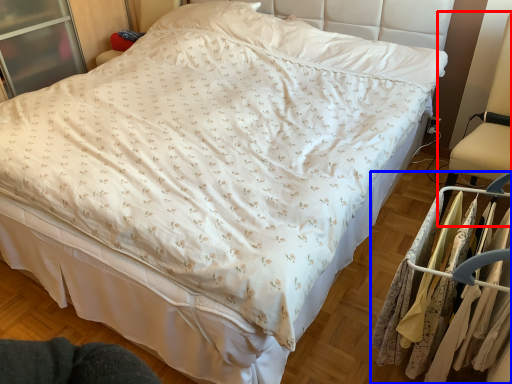
Question: Which object is closer to the camera taking this photo, swivel chair (highlighted by a red box) or closet (highlighted by a blue box)?

Choices:
 (A) swivel chair
 (B) closet

Answer: (B)